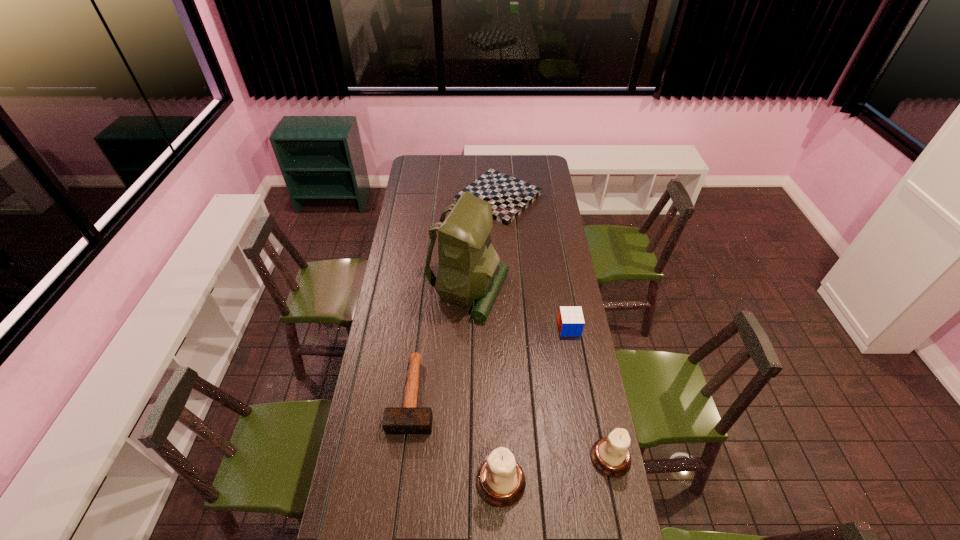
Locate an element on the screen. The width and height of the screenshot is (960, 540). vacant point located between the fifth shortest object and the mallet is located at coordinates (457, 438).

Where is `vacant space that is in between the fifth shortest object and the tallest object`? This screenshot has width=960, height=540. vacant space that is in between the fifth shortest object and the tallest object is located at coordinates (485, 387).

The width and height of the screenshot is (960, 540). What are the coordinates of `free space between the left candle holder and the right candle holder` in the screenshot? It's located at (556, 470).

Image resolution: width=960 pixels, height=540 pixels. In order to click on free space between the left candle holder and the third shortest object in this screenshot , I will do `click(535, 405)`.

Where is `unoccupied area between the tallest object and the fifth tallest object`? This screenshot has height=540, width=960. unoccupied area between the tallest object and the fifth tallest object is located at coordinates (441, 343).

Where is `free spot between the third shortest object and the left candle holder`? free spot between the third shortest object and the left candle holder is located at coordinates (535, 405).

Select which object appears as the fifth closest to the taller candle holder. Please provide its 2D coordinates. Your answer should be formatted as a tuple, i.e. [(x, y)], where the tuple contains the x and y coordinates of a point satisfying the conditions above.

[(509, 197)]

The height and width of the screenshot is (540, 960). Find the location of `object that is the fourth nearest to the tallest object`. object that is the fourth nearest to the tallest object is located at coordinates click(x=610, y=455).

In order to click on free space that satisfies the following two spatial constraints: 1. on the front side of the cube; 2. on the right side of the shortest object in this screenshot , I will do `click(505, 328)`.

Image resolution: width=960 pixels, height=540 pixels. I want to click on free location that satisfies the following two spatial constraints: 1. on the back side of the cube; 2. on the front of the backpack with visible pockets, so click(563, 292).